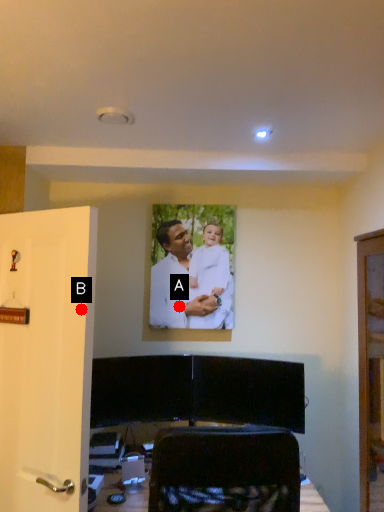
Question: Two points are circled on the image, labeled by A and B beside each circle. Which point appears closest to the camera in this image?

Choices:
 (A) A is closer
 (B) B is closer

Answer: (B)